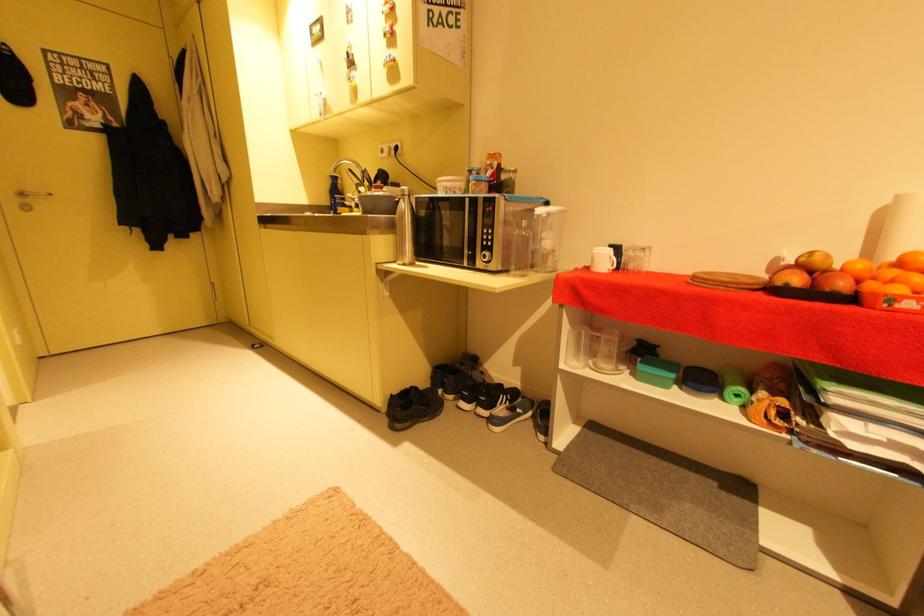
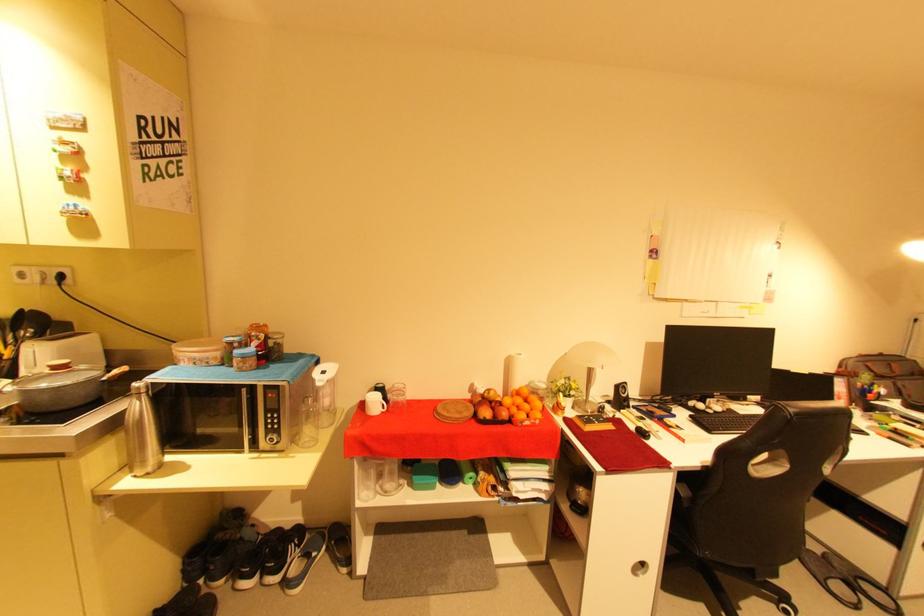
In the second image, find the point that corresponds to pixel 602 253 in the first image.

(374, 400)